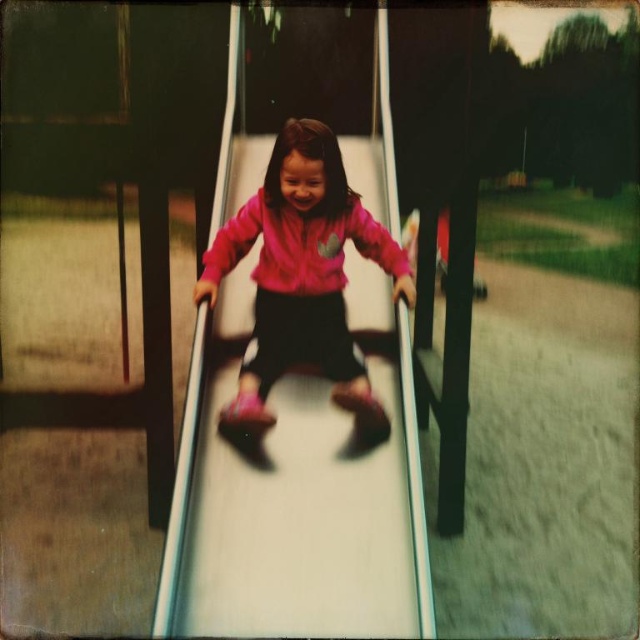
From the picture: Can you confirm if white plastic slide at center is positioned below pink matte jacket at center?

Yes.

Does point (321, 465) come behind point (403, 257)?

No, it is in front of (403, 257).

The width and height of the screenshot is (640, 640). Find the location of `white plastic slide at center`. white plastic slide at center is located at coordinates (298, 493).